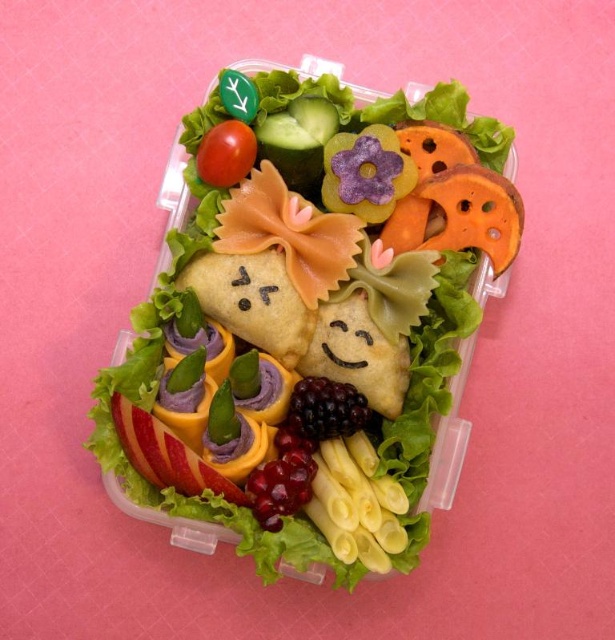
Based on the photo, you are a food stylist arranging a bento box. You want to ensure that the blackberry at center and the red smooth tomato at upper left are visible to the viewer. Based on their positions, which one is more likely to be seen first?

The blackberry at center is in front of the red smooth tomato at upper left, so it will be seen first by the viewer.

You are looking at the bento box from above. There are two points marked on the bento box contents. The first point is at coordinate point [349,488] and the second point is at coordinate point [205,163]. Which point is closer to you?

Point [349,488] is closer to the camera than point [205,163], so the first point is closer to you.

Looking at this image, you are looking at the bento box and notice two points marked in the image. The first point is at coordinates point (373, 532) and the second is at point (360, 410). Which of these points is closer to you?

Point (373, 532) is in front of point (360, 410), so it is closer to you.